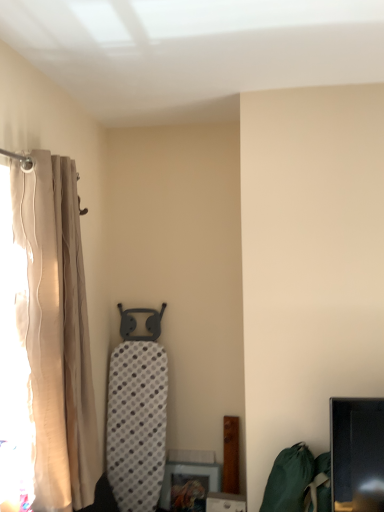
Question: Looking at their shapes, would you say beige fabric curtain at left is wider or thinner than green fabric bean bag chair at lower right?

Choices:
 (A) thin
 (B) wide

Answer: (A)

Question: In the image, is beige fabric curtain at left positioned in front of or behind green fabric bean bag chair at lower right?

Choices:
 (A) front
 (B) behind

Answer: (A)

Question: Would you say beige fabric curtain at left is inside or outside green fabric bean bag chair at lower right?

Choices:
 (A) inside
 (B) outside

Answer: (B)

Question: In the image, is green fabric bean bag chair at lower right on the left side or the right side of beige fabric curtain at left?

Choices:
 (A) left
 (B) right

Answer: (B)

Question: Is green fabric bean bag chair at lower right spatially inside beige fabric curtain at left, or outside of it?

Choices:
 (A) inside
 (B) outside

Answer: (B)

Question: From their relative heights in the image, would you say green fabric bean bag chair at lower right is taller or shorter than beige fabric curtain at left?

Choices:
 (A) tall
 (B) short

Answer: (B)

Question: Is green fabric bean bag chair at lower right in front of or behind beige fabric curtain at left in the image?

Choices:
 (A) behind
 (B) front

Answer: (A)